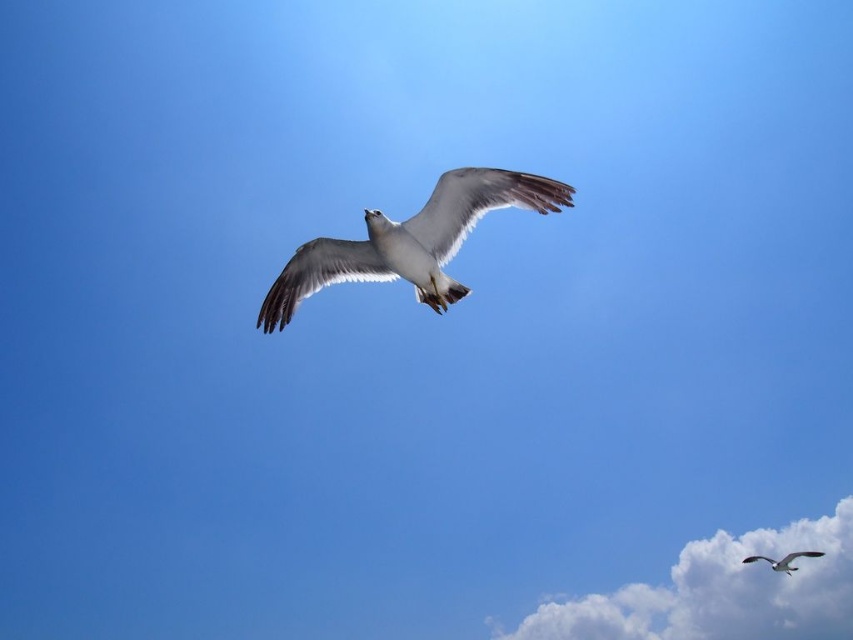
Question: Is white fluffy cloud at lower right smaller than white feathered bird at center?

Choices:
 (A) yes
 (B) no

Answer: (B)

Question: Which point appears farthest from the camera in this image?

Choices:
 (A) 631,600
 (B) 776,564

Answer: (A)

Question: Estimate the real-world distances between objects in this image. Which object is closer to the white feathered bird at center?

Choices:
 (A) white feathered bird at lower right
 (B) white fluffy cloud at lower right

Answer: (B)

Question: Is white fluffy cloud at lower right smaller than white feathered bird at center?

Choices:
 (A) no
 (B) yes

Answer: (A)

Question: Among these points, which one is farthest from the camera?

Choices:
 (A) (457, 193)
 (B) (628, 602)

Answer: (B)

Question: Does white feathered bird at center appear over white feathered bird at lower right?

Choices:
 (A) yes
 (B) no

Answer: (A)